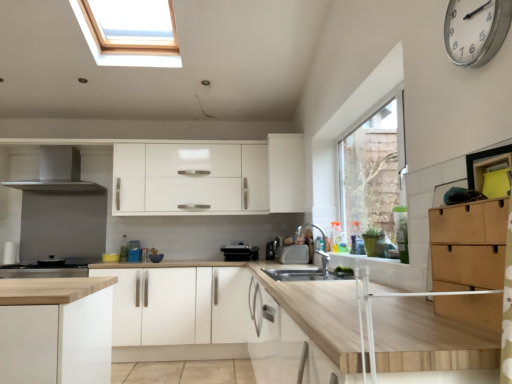
This screenshot has width=512, height=384. What are the coordinates of `vacant space that is to the left of light brown wood drawer at right, acting as the 2th cabinetry starting from the top` in the screenshot? It's located at (417, 328).